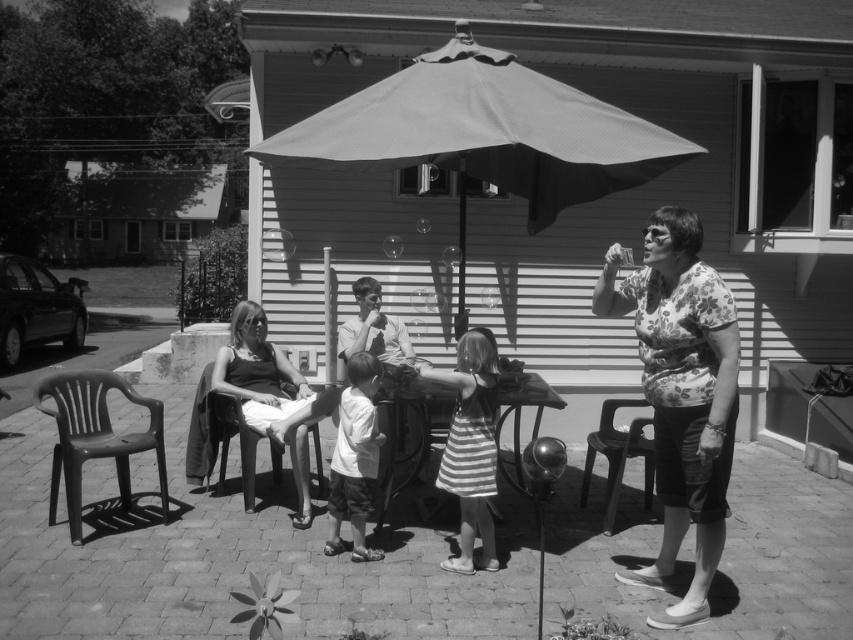
You are a photographer setting up for a group photo. You need to place a tripod between the black plastic chair at lower left and the white cotton shirt at center. Considering their widths, which object should the tripod be closer to to ensure stability?

The black plastic chair at lower left is wider than the white cotton shirt at center. To ensure stability, the tripod should be placed closer to the black plastic chair at lower left since it has a larger base area.

You are a photographer at the event and want to ensure both the striped fabric dress at center and the white cotton shirt at center are visible in your photo. Which clothing item should you focus on first to ensure it doesn t get cropped out?

The striped fabric dress at center has a larger size compared to the white cotton shirt at center, so you should focus on ensuring the striped fabric dress at center is fully visible first to prevent it from being cropped out.

You are standing at the edge of the patio and want to hand a drink to the person wearing the white cotton shirt at center. If you can throw a drink 5 meters, will you be able to reach them?

The white cotton shirt at center is 5.15 meters away from the viewer. Since you can only throw 5 meters, you won not be able to reach them.